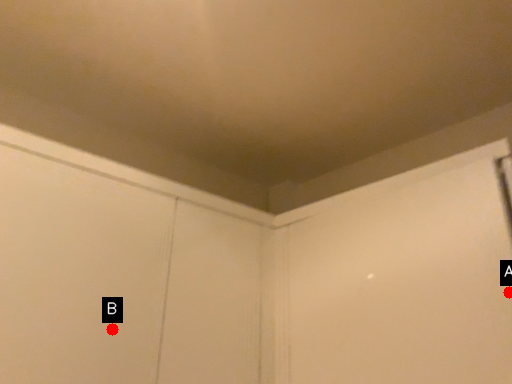
Question: Two points are circled on the image, labeled by A and B beside each circle. Which point is further to the camera?

Choices:
 (A) A is further
 (B) B is further

Answer: (B)